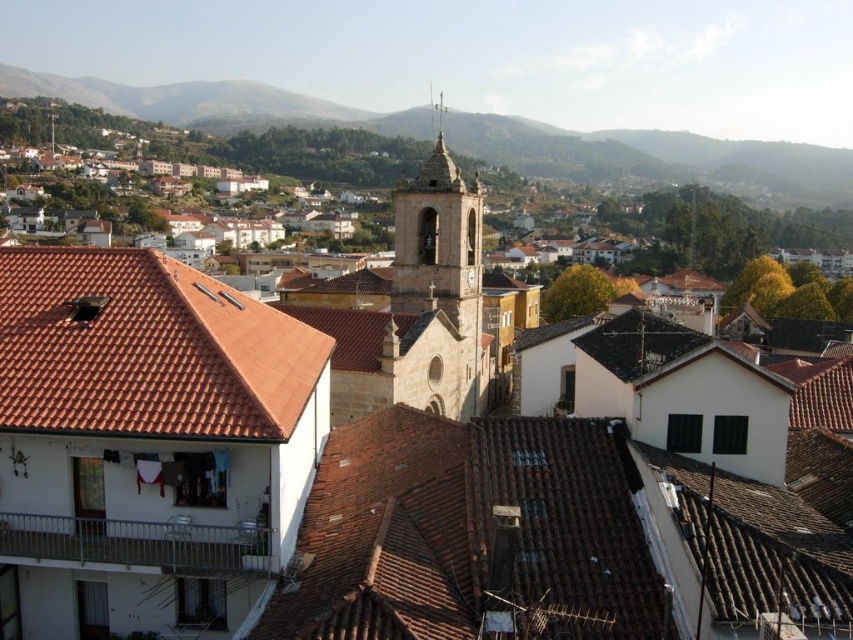
You are an architect designing a new building in the town. You need to ensure that your building does not block the view of the shiny silver spire at upper center from the red tile roof at left. Based on their heights, is this possible?

The red tile roof at left is not as tall as the shiny silver spire at upper center, so it is possible to design the new building in a way that does not block the view of the spire from the roof since the spire is taller.

You are standing at the center of the town square and looking towards the church steeple. There is a red tile roof at left. Where is the point located at coordinates point (144, 348)?

The point (144, 348) is located on the red tile roof at left.

From the picture: You are standing in the town square and want to visit the church steeple. If you walk straight ahead, will you reach the steeple before the point located at coordinate point (439,413)?

The point at coordinate (439,413) is 46.60 meters away from the viewer. Since the church steeple is the central focus and stands tall above the rooftops, walking straight ahead would lead you towards the steeple first before reaching the point at (439,413).